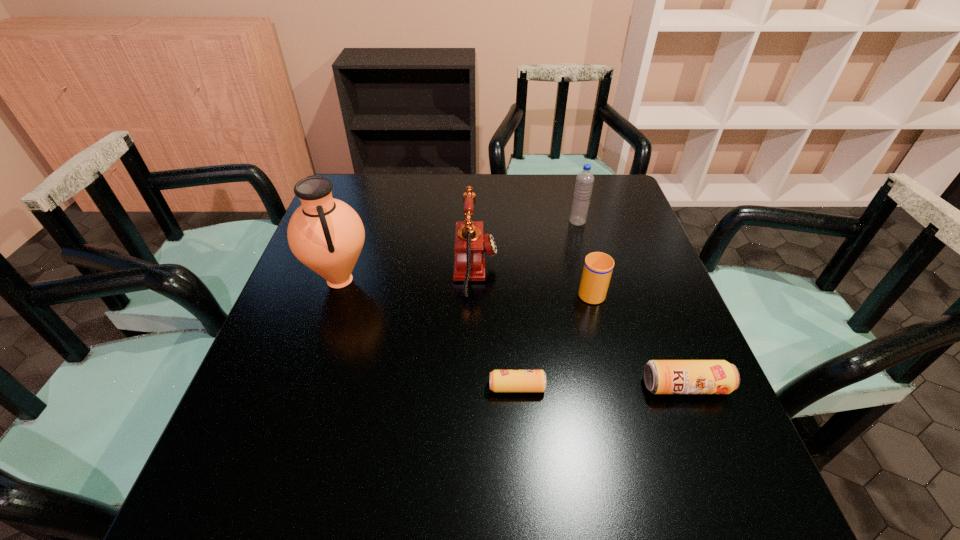
The width and height of the screenshot is (960, 540). Identify the location of the shortest object. [499, 380].

Where is `the shorter beer can`? This screenshot has height=540, width=960. the shorter beer can is located at coordinates (499, 380).

Locate an element on the screen. This screenshot has height=540, width=960. the right beer can is located at coordinates (660, 376).

This screenshot has width=960, height=540. I want to click on the rightmost object, so click(x=660, y=376).

Locate an element on the screen. The width and height of the screenshot is (960, 540). cup is located at coordinates (598, 267).

What are the coordinates of `pitcher` in the screenshot? It's located at (327, 235).

This screenshot has height=540, width=960. Find the location of `the tallest object`. the tallest object is located at coordinates (327, 235).

The width and height of the screenshot is (960, 540). In order to click on the farthest object in this screenshot , I will do `click(584, 182)`.

The height and width of the screenshot is (540, 960). I want to click on telephone, so click(x=469, y=262).

Where is `free space located 0.050m on the back of the left beer can`? The width and height of the screenshot is (960, 540). free space located 0.050m on the back of the left beer can is located at coordinates (515, 358).